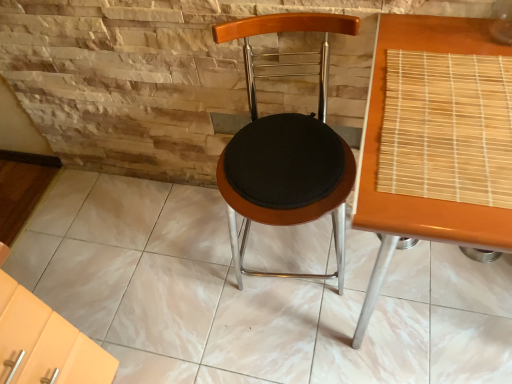
The height and width of the screenshot is (384, 512). Identify the location of free space in front of woodenseat cushion at center. (278, 354).